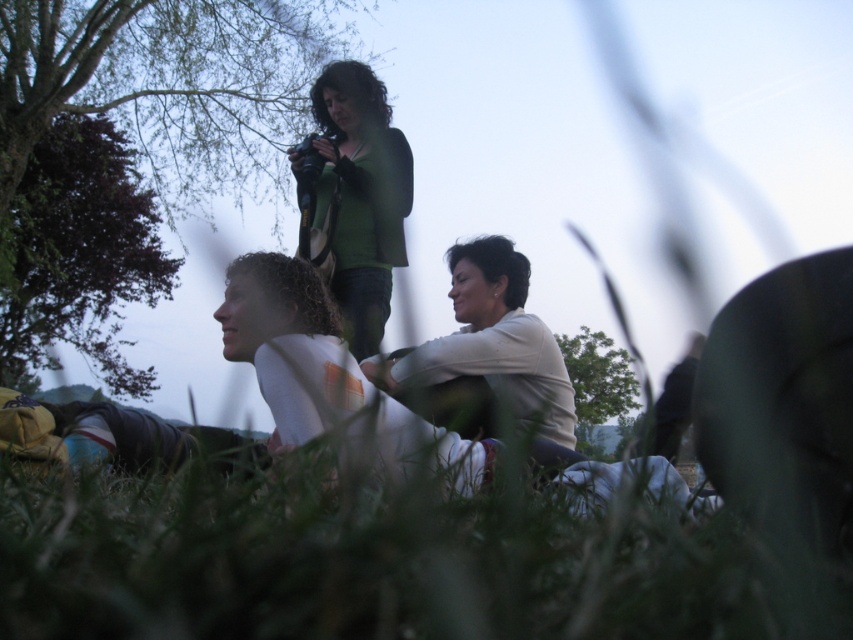
You are standing in the serene outdoor scene depicted. You want to place a small decorative rock exactly at the location marked by the green grass at lower center. What are the coordinates where you should place the rock?

The coordinates for the green grass at lower center are point (376, 563), so you should place the rock there.

You are standing in the scene and want to place a small flag at each of the two points. Which point, point (402, 576) or point (271, 353), will have its flag appear closer to you when viewed from your current position?

Point (402, 576) is closer to the viewer than point (271, 353), so the flag placed at point (402, 576) will appear closer.